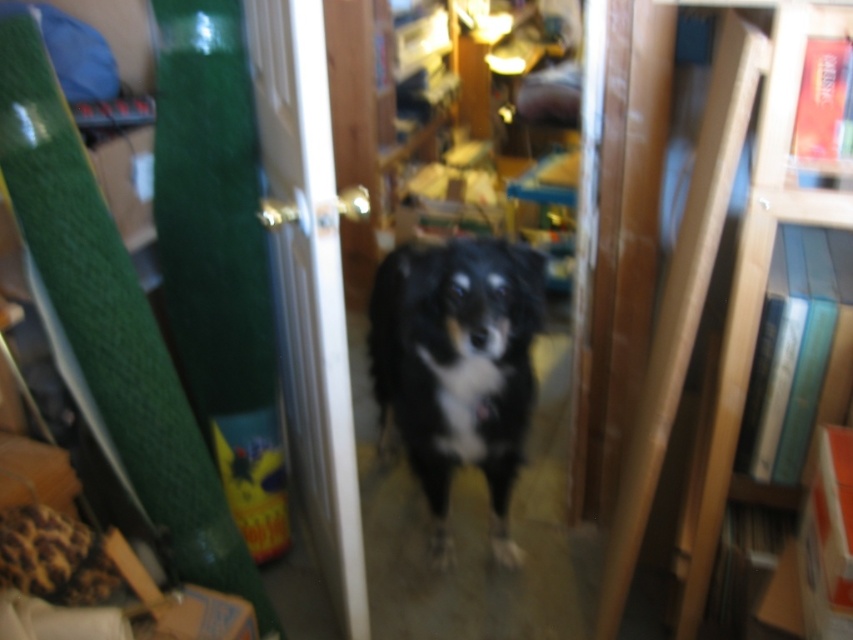
Measure the distance between wooden bookcase at right and camera.

The distance of wooden bookcase at right from camera is 1.10 meters.

Between point (805, 3) and point (401, 250), which one is positioned in front?

Point (805, 3) is in front.

Find the location of `wooden bookcase at right`. wooden bookcase at right is located at coordinates (730, 289).